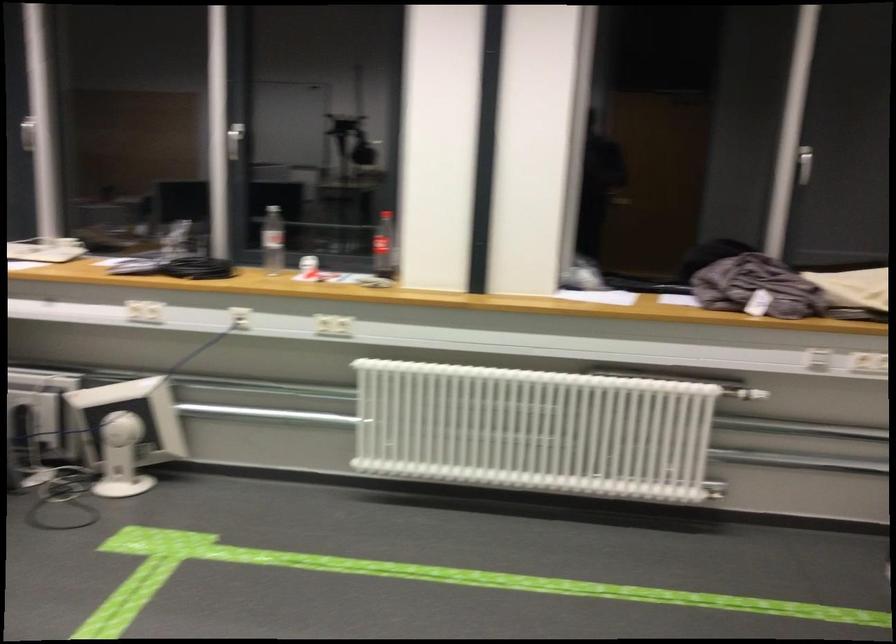
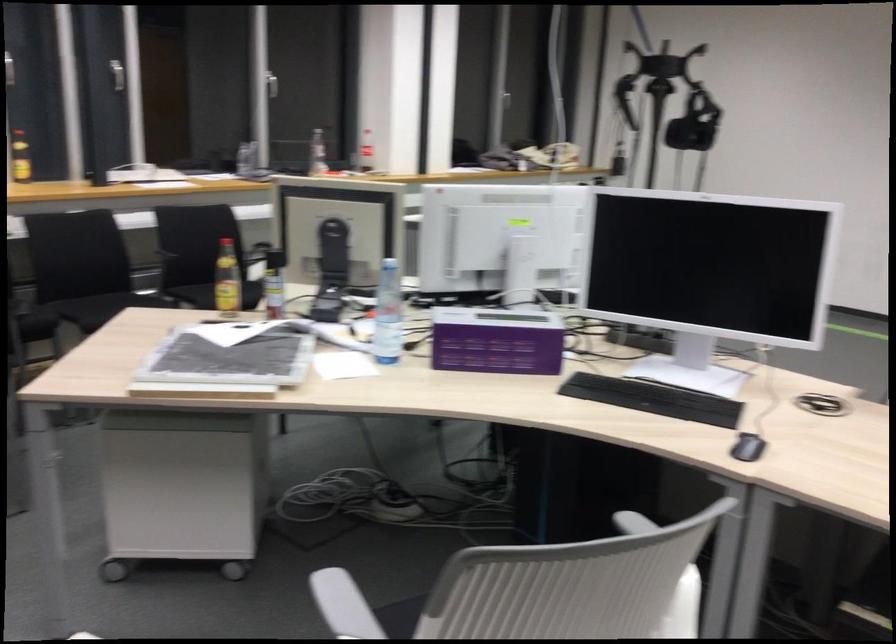
Question: I am providing you with two images of the same scene from different viewpoints. Which of the following objects are not visible in image2?

Choices:
 (A) wheeled filing cabinet
 (B) white chair armrest
 (C) small blue card
 (D) white desk fan

Answer: (D)